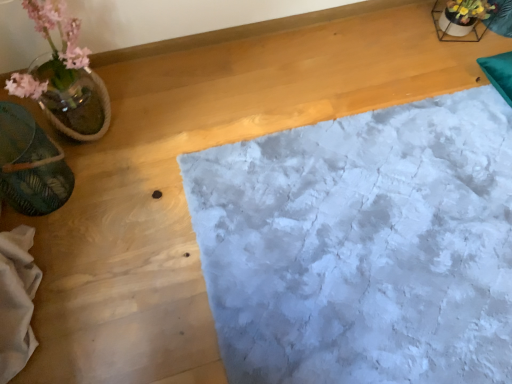
This screenshot has height=384, width=512. I want to click on vacant space in white textured rug at center (from a real-world perspective), so click(375, 238).